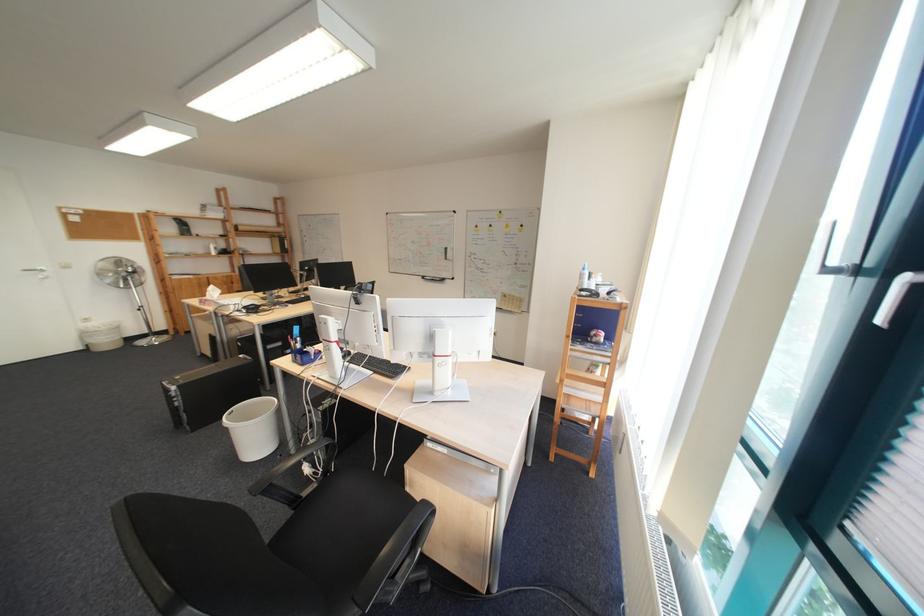
Where would you lift the white trash can? Please return your answer as a coordinate pair (x, y).

(252, 428)